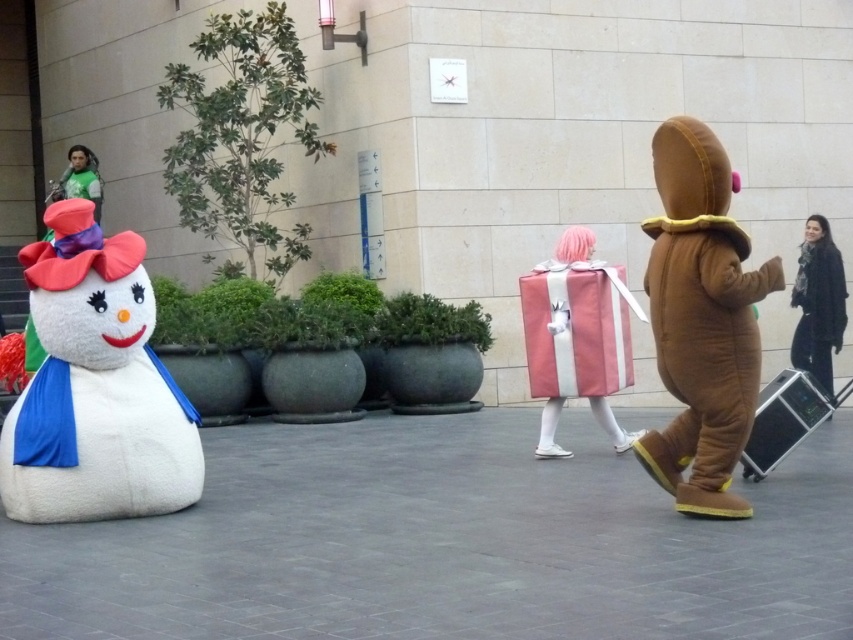
Question: Among these objects, which one is nearest to the camera?

Choices:
 (A) white plush snowman at left
 (B) brown plush bear at right

Answer: (B)

Question: Can you confirm if brown plush bear at right is positioned to the left of pink matte gift at center?

Choices:
 (A) yes
 (B) no

Answer: (B)

Question: Which point is closer to the camera?

Choices:
 (A) (102, 452)
 (B) (793, 352)
 (C) (47, 198)
 (D) (585, 257)

Answer: (A)

Question: Does white plush snowman at left have a larger size compared to pink matte gift at center?

Choices:
 (A) no
 (B) yes

Answer: (A)

Question: In this image, where is white plush snowman at left located relative to pink matte gift at center?

Choices:
 (A) above
 (B) below

Answer: (B)

Question: Estimate the real-world distances between objects in this image. Which object is closer to the white plush snowman at left?

Choices:
 (A) brown plush bear at right
 (B) pink matte gift at center

Answer: (B)